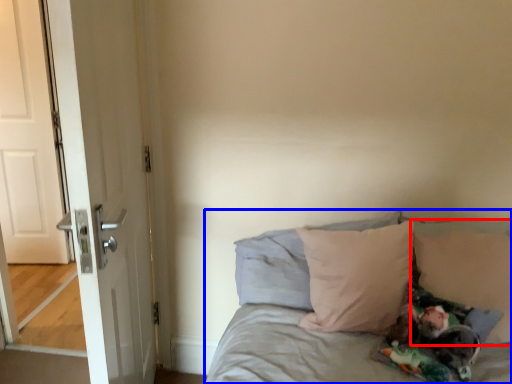
Question: Which object is closer to the camera taking this photo, pillow (highlighted by a red box) or bed (highlighted by a blue box)?

Choices:
 (A) pillow
 (B) bed

Answer: (B)